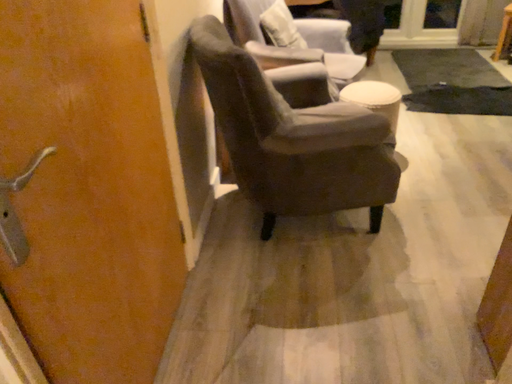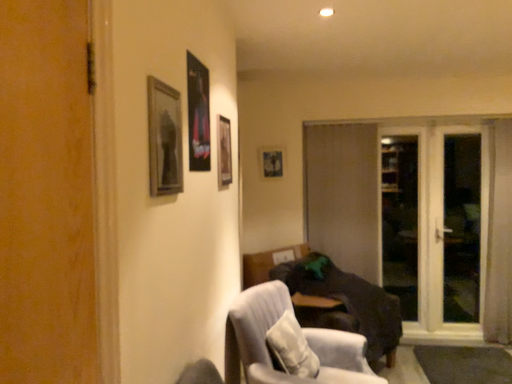
Question: Which way did the camera rotate in the video?

Choices:
 (A) rotated upward
 (B) rotated downward

Answer: (A)